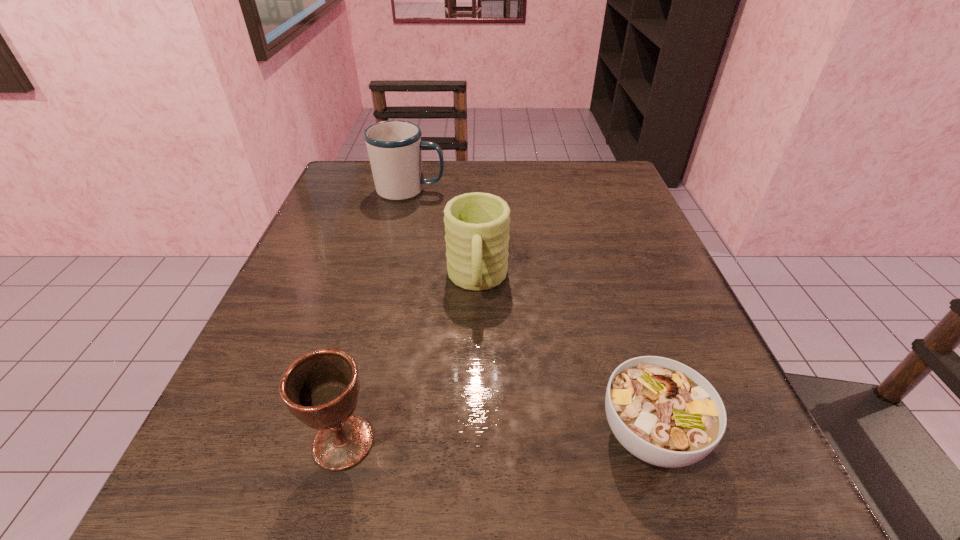
Locate an element on the screen. The height and width of the screenshot is (540, 960). the left mug is located at coordinates point(394,147).

At what (x,y) coordinates should I click in order to perform the action: click on the farther mug. Please return your answer as a coordinate pair (x, y). The width and height of the screenshot is (960, 540). Looking at the image, I should click on (394, 147).

Find the location of a particular element. This screenshot has height=540, width=960. the third object from left to right is located at coordinates (477, 224).

This screenshot has width=960, height=540. Find the location of `the third nearest object`. the third nearest object is located at coordinates (477, 224).

Where is `chalice`? The image size is (960, 540). chalice is located at coordinates (320, 388).

Where is `soup bowl`? soup bowl is located at coordinates click(x=663, y=412).

This screenshot has height=540, width=960. Identify the location of the rightmost object. (663, 412).

At what (x,y) coordinates should I click in order to perform the action: click on blank space located 0.070m on the handle side of the farther mug. Please return your answer as a coordinate pair (x, y). Looking at the image, I should click on (475, 190).

Where is `vacant region located 0.130m on the side of the second farthest object with the handle`? The image size is (960, 540). vacant region located 0.130m on the side of the second farthest object with the handle is located at coordinates (476, 377).

Locate an element on the screen. This screenshot has width=960, height=540. free space located 0.250m on the right of the chalice is located at coordinates click(569, 442).